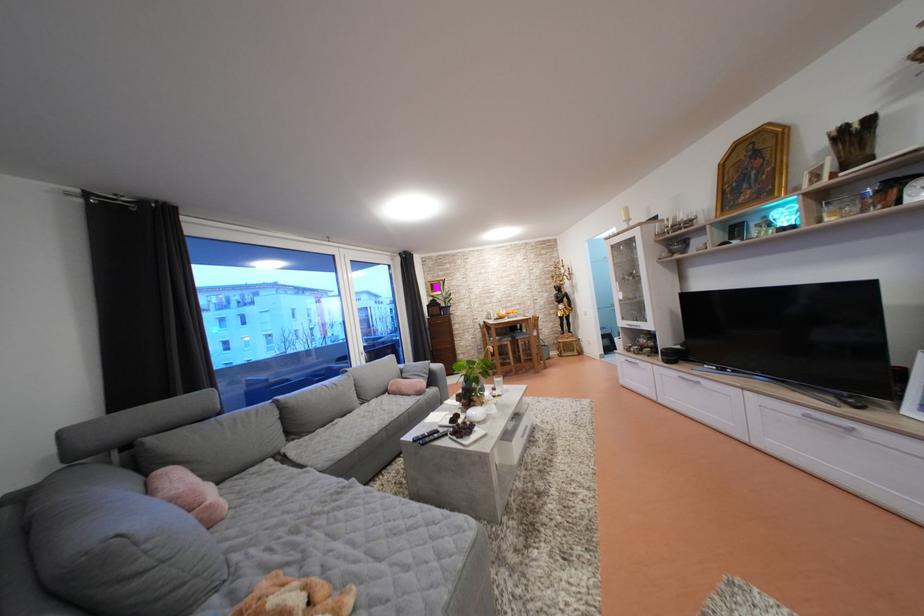
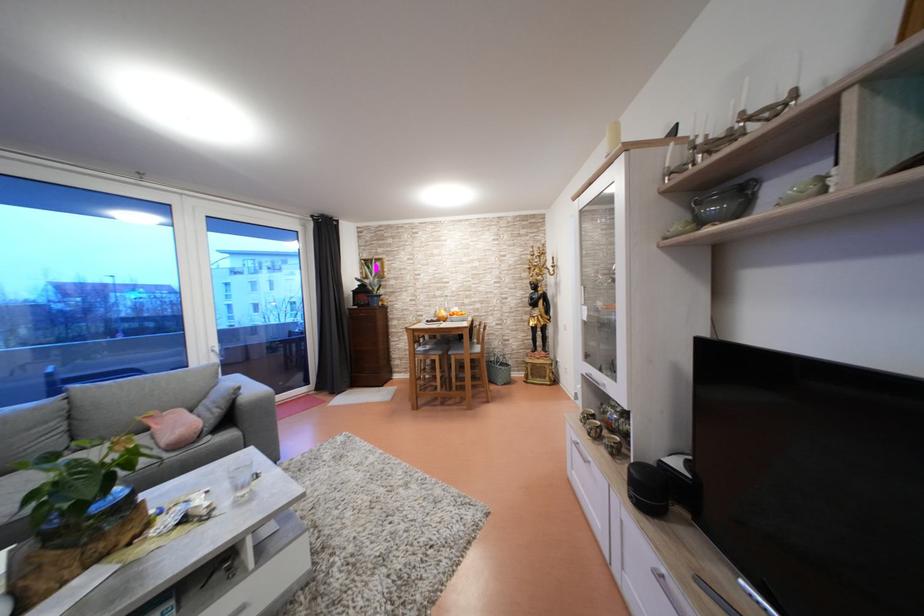
Locate, in the second image, the point that corresponds to pixel 690 243 in the first image.

(748, 185)